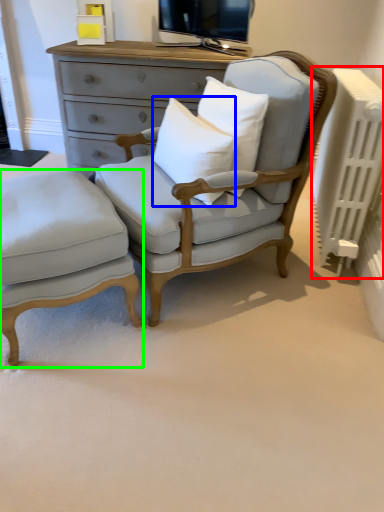
Question: Which object is positioned farthest from radiator (highlighted by a red box)? Select from pillow (highlighted by a blue box) and nightstand (highlighted by a green box).

Choices:
 (A) pillow
 (B) nightstand

Answer: (B)